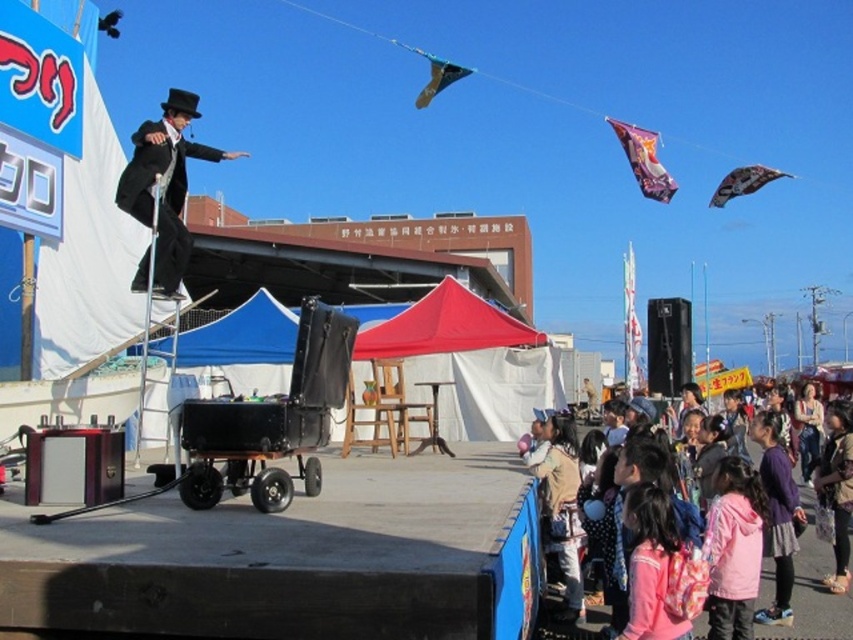
Question: Is purple fabric dress at lower right positioned at the back of patterned fabric kite at upper right?

Choices:
 (A) no
 (B) yes

Answer: (A)

Question: Which of the following is the farthest from the observer?

Choices:
 (A) purple fabric kite at upper right
 (B) fluffy brown coat at lower right

Answer: (A)

Question: Which of the following is the farthest from the observer?

Choices:
 (A) (576, 577)
 (B) (838, 579)

Answer: (B)

Question: Can you confirm if fluffy brown coat at lower right is thinner than purple fabric kite at upper right?

Choices:
 (A) yes
 (B) no

Answer: (A)

Question: Is red fabric canopy at center positioned at the back of pink fabric crowd at lower right?

Choices:
 (A) no
 (B) yes

Answer: (B)

Question: Which point is closer to the camera?

Choices:
 (A) (770, 570)
 (B) (532, 472)

Answer: (B)